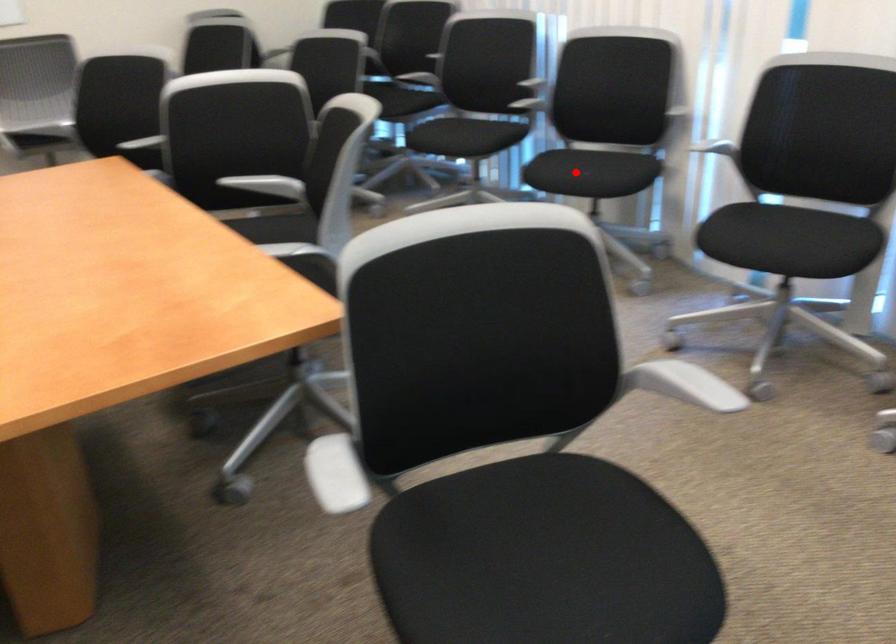
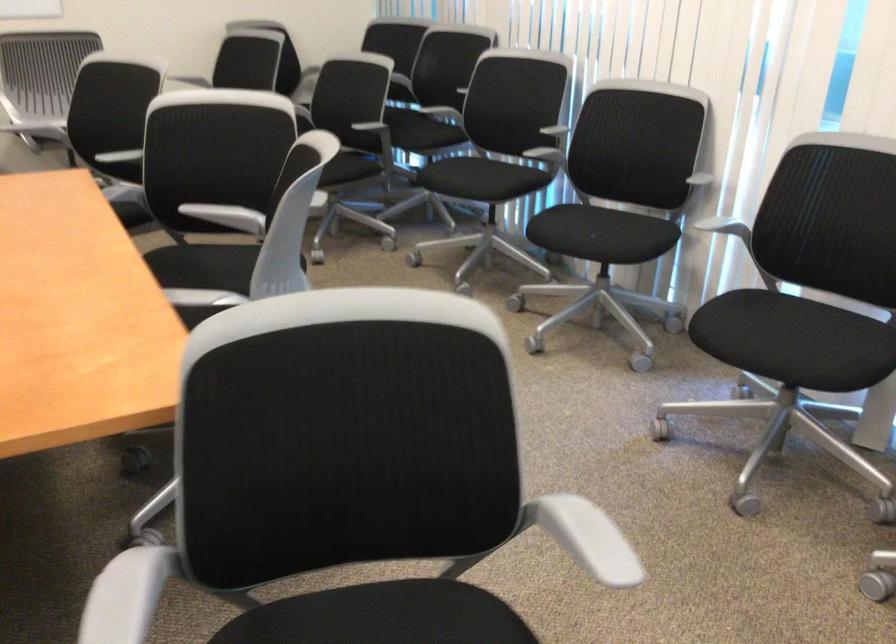
Where in the second image is the point corresponding to the highlighted location from the first image?

(582, 232)